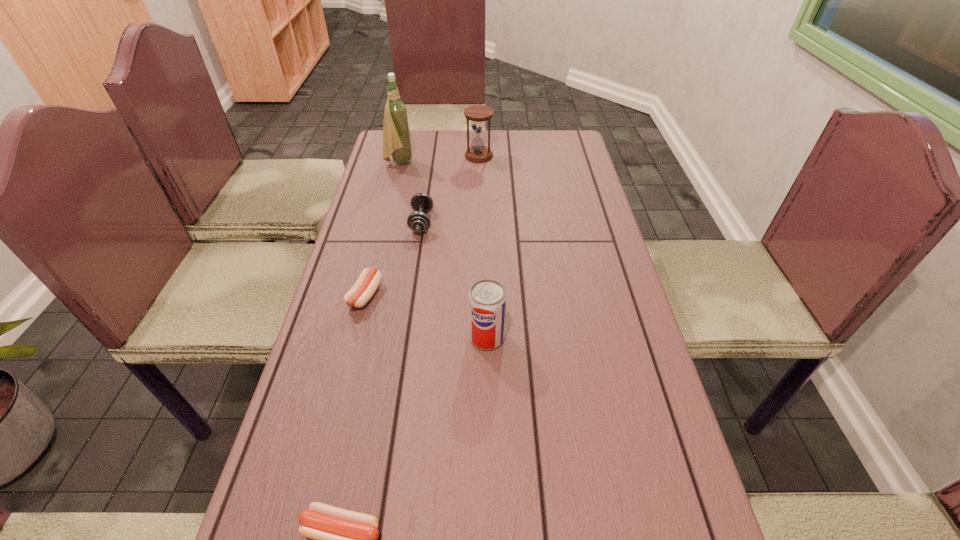
Where is `free space located 0.350m on the front of the farther sausage`? This screenshot has width=960, height=540. free space located 0.350m on the front of the farther sausage is located at coordinates (324, 462).

The height and width of the screenshot is (540, 960). Identify the location of wine bottle that is at the far edge. (396, 135).

Identify the location of hourglass positioned at the far edge. The width and height of the screenshot is (960, 540). (478, 153).

Locate an element on the screen. Image resolution: width=960 pixels, height=540 pixels. wine bottle situated at the left edge is located at coordinates [x=396, y=135].

Locate an element on the screen. This screenshot has height=540, width=960. dumbbell that is at the left edge is located at coordinates (418, 221).

Locate an element on the screen. The height and width of the screenshot is (540, 960). sausage that is at the left edge is located at coordinates (366, 285).

Identify the location of object that is at the far left corner. The height and width of the screenshot is (540, 960). (396, 135).

In the image, there is a desktop. Where is `free space at the far edge`? The image size is (960, 540). free space at the far edge is located at coordinates (498, 135).

I want to click on free point at the left edge, so point(314,433).

This screenshot has height=540, width=960. Identify the location of vacant space at the right edge of the desktop. (655, 411).